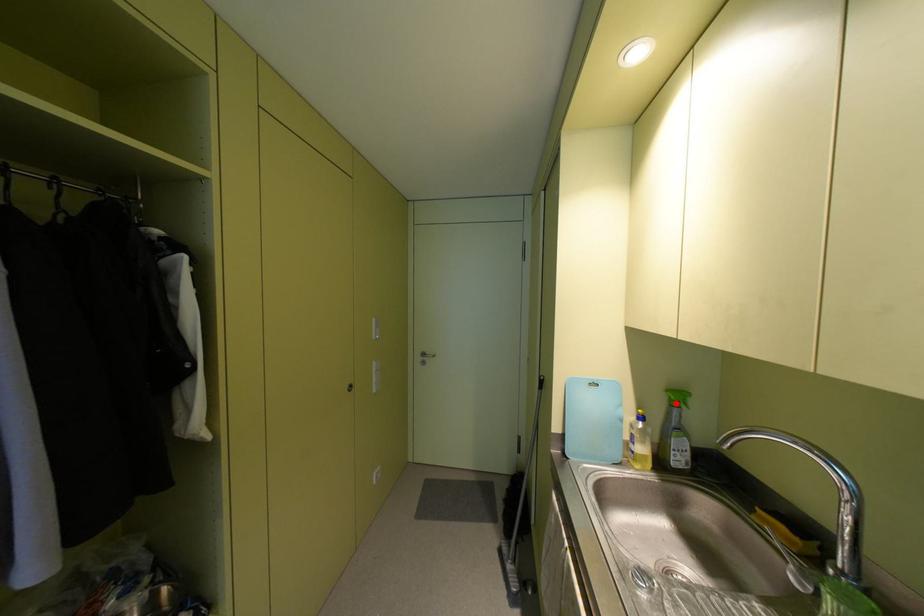
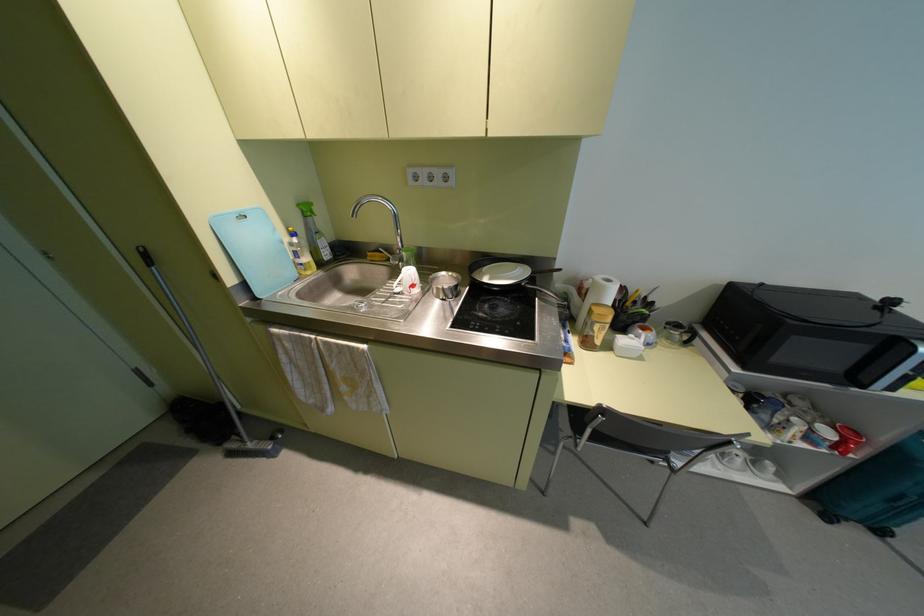
Question: I am providing you with two images of the same scene from different viewpoints. Given a red point in image1, look at the same physical point in image2. Is it:

Choices:
 (A) Closer to the viewpoint
 (B) Farther from the viewpoint

Answer: (A)